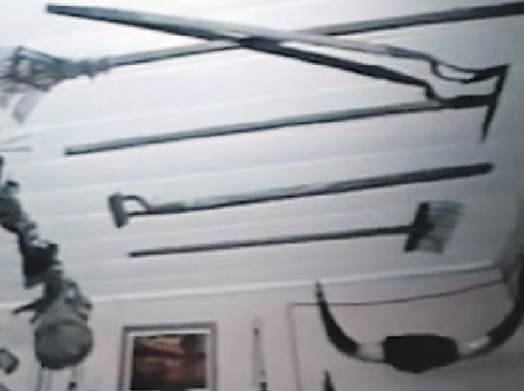
Identify the location of white paneling. (122, 171), (87, 227), (111, 271).